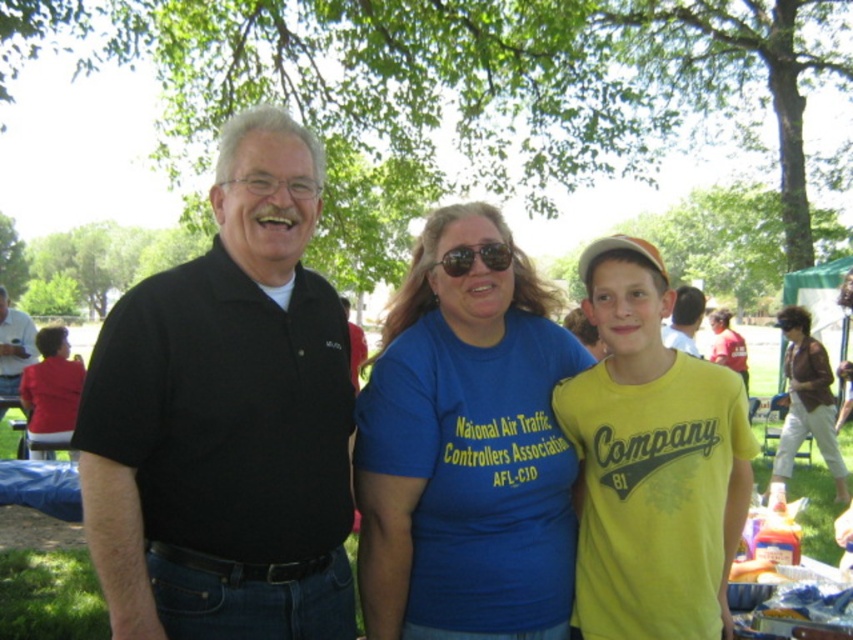
Question: Among these points, which one is nearest to the camera?

Choices:
 (A) (683, 305)
 (B) (67, 344)
 (C) (200, 572)

Answer: (C)

Question: Is black matte shirt at center to the left of black shirt at center from the viewer's perspective?

Choices:
 (A) no
 (B) yes

Answer: (A)

Question: Which point is farther to the camera?

Choices:
 (A) (746, 403)
 (B) (459, 253)
 (C) (49, 406)
 (D) (683, 292)

Answer: (C)

Question: Among these points, which one is farthest from the camera?

Choices:
 (A) (27, 317)
 (B) (583, 372)
 (C) (456, 250)
 (D) (107, 328)

Answer: (A)

Question: Is black matte shirt at center to the right of brown leather jacket at lower right from the viewer's perspective?

Choices:
 (A) yes
 (B) no

Answer: (B)

Question: Is blue t-shirt at center thinner than red fabric jacket at left?

Choices:
 (A) yes
 (B) no

Answer: (A)